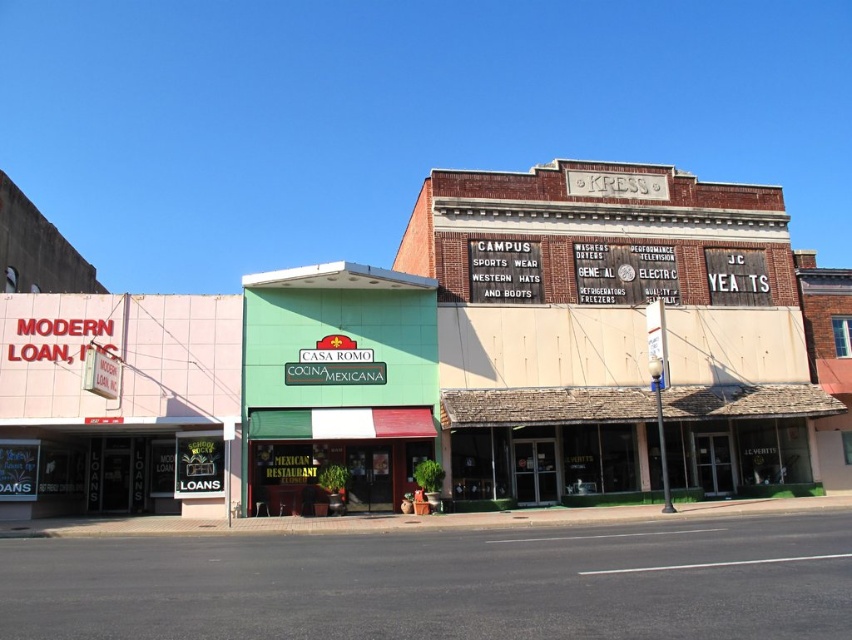
Is point (188, 317) more distant than point (360, 326)?

No, (188, 317) is closer to viewer.

Does green painted building at center have a smaller size compared to green matte signboard at center?

No.

Between point (173, 330) and point (271, 484), which one is positioned behind?

The point (173, 330) is more distant.

The image size is (852, 640). Identify the location of green painted building at center. (452, 360).